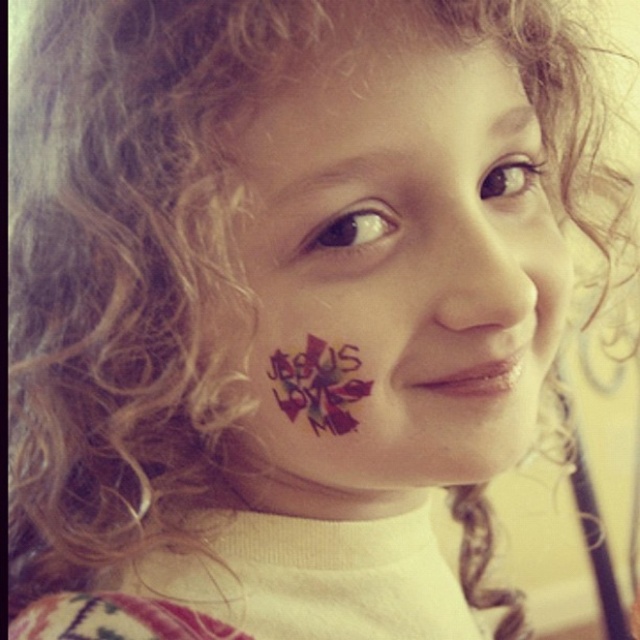
Question: Is matte skin nose at center positioned at the back of multicolored painted flower at center?

Choices:
 (A) yes
 (B) no

Answer: (B)

Question: Does dark red matte text at cheek center have a lesser width compared to matte skin nose at center?

Choices:
 (A) yes
 (B) no

Answer: (B)

Question: Which of these objects is positioned closest to the multicolored painted flower at center?

Choices:
 (A) matte skin nose at center
 (B) dark red matte text at cheek center

Answer: (B)

Question: Is dark red matte text at cheek center below multicolored painted flower at center?

Choices:
 (A) yes
 (B) no

Answer: (B)

Question: Considering the real-world distances, which object is farthest from the dark red matte text at cheek center?

Choices:
 (A) multicolored painted flower at center
 (B) matte skin nose at center

Answer: (A)

Question: Which object is positioned farthest from the multicolored painted flower at center?

Choices:
 (A) dark red matte text at cheek center
 (B) matte skin nose at center

Answer: (B)